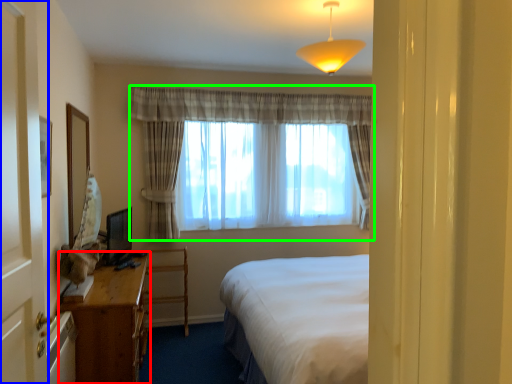
Question: Which is nearer to the desk (highlighted by a red box)? screen door (highlighted by a blue box) or curtain (highlighted by a green box).

Choices:
 (A) screen door
 (B) curtain

Answer: (A)